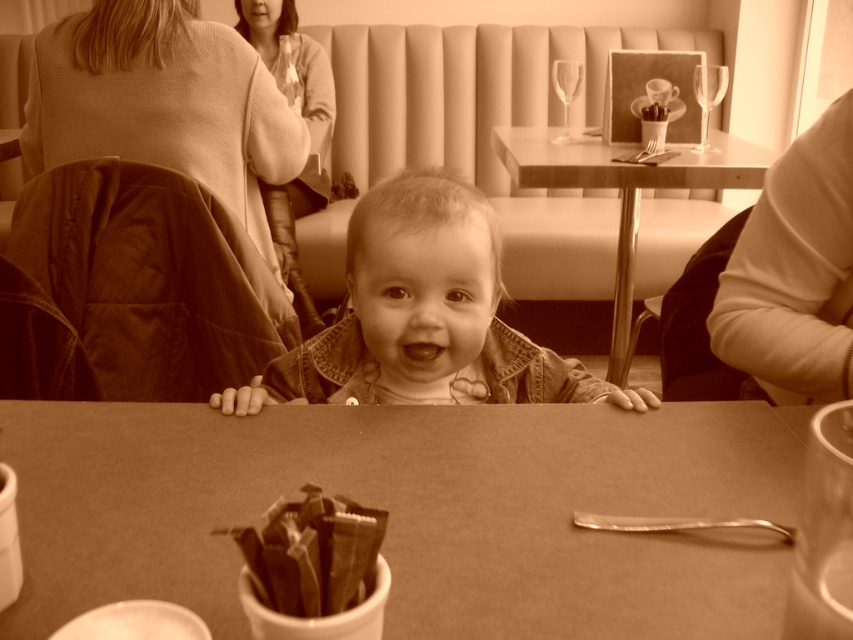
You are a photographer setting up equipment in the restaurant. You need to place a 40 cm wide camera on the table. The smooth brown table at center and the smooth wood table at center are both available. Which table can accommodate the camera without overhanging the edge?

The smooth brown table at center has a greater width than the smooth wood table at center, so the smooth brown table at center can accommodate the 40 cm wide camera without overhanging the edge.